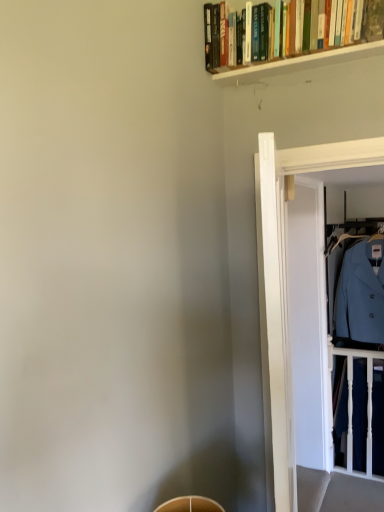
Question: Could transparent glass door at right be considered to be inside white wooden balustrade at right?

Choices:
 (A) no
 (B) yes

Answer: (A)

Question: From a real-world perspective, is white wooden balustrade at right under transparent glass door at right?

Choices:
 (A) no
 (B) yes

Answer: (B)

Question: From a real-world perspective, is white wooden balustrade at right positioned over transparent glass door at right based on gravity?

Choices:
 (A) yes
 (B) no

Answer: (B)

Question: Is white wooden balustrade at right with transparent glass door at right?

Choices:
 (A) no
 (B) yes

Answer: (A)

Question: Considering the relative sizes of white wooden balustrade at right and transparent glass door at right in the image provided, is white wooden balustrade at right taller than transparent glass door at right?

Choices:
 (A) no
 (B) yes

Answer: (A)

Question: Considering the positions of white wooden balustrade at right and light blue woolen coat at right in the image, is white wooden balustrade at right wider or thinner than light blue woolen coat at right?

Choices:
 (A) thin
 (B) wide

Answer: (A)

Question: Considering the relative positions of white wooden balustrade at right and light blue woolen coat at right in the image provided, is white wooden balustrade at right to the left or to the right of light blue woolen coat at right?

Choices:
 (A) left
 (B) right

Answer: (A)

Question: Considering the positions of point (332, 360) and point (379, 342), is point (332, 360) closer or farther from the camera than point (379, 342)?

Choices:
 (A) farther
 (B) closer

Answer: (A)

Question: Choose the correct answer: Is white wooden balustrade at right inside light blue woolen coat at right or outside it?

Choices:
 (A) outside
 (B) inside

Answer: (A)

Question: Looking at the image, does transparent glass door at right seem bigger or smaller compared to light blue woolen coat at right?

Choices:
 (A) big
 (B) small

Answer: (B)

Question: Is transparent glass door at right spatially inside light blue woolen coat at right, or outside of it?

Choices:
 (A) inside
 (B) outside

Answer: (B)

Question: From a real-world perspective, is transparent glass door at right above or below light blue woolen coat at right?

Choices:
 (A) above
 (B) below

Answer: (B)

Question: Considering the positions of transparent glass door at right and light blue woolen coat at right in the image, is transparent glass door at right wider or thinner than light blue woolen coat at right?

Choices:
 (A) thin
 (B) wide

Answer: (A)

Question: From the image's perspective, is light blue woolen coat at right located above or below white wooden balustrade at right?

Choices:
 (A) below
 (B) above

Answer: (B)

Question: In terms of width, does light blue woolen coat at right look wider or thinner when compared to white wooden balustrade at right?

Choices:
 (A) thin
 (B) wide

Answer: (B)